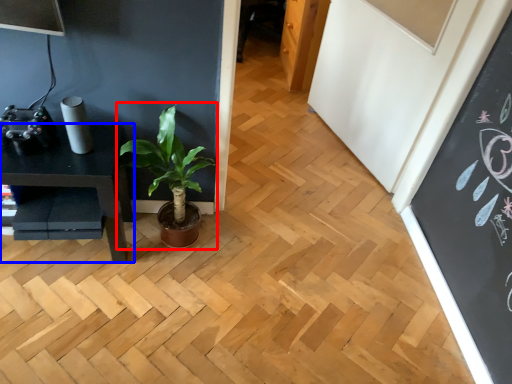
Question: Which of the following is the closest to the observer, houseplant (highlighted by a red box) or table (highlighted by a blue box)?

Choices:
 (A) houseplant
 (B) table

Answer: (A)